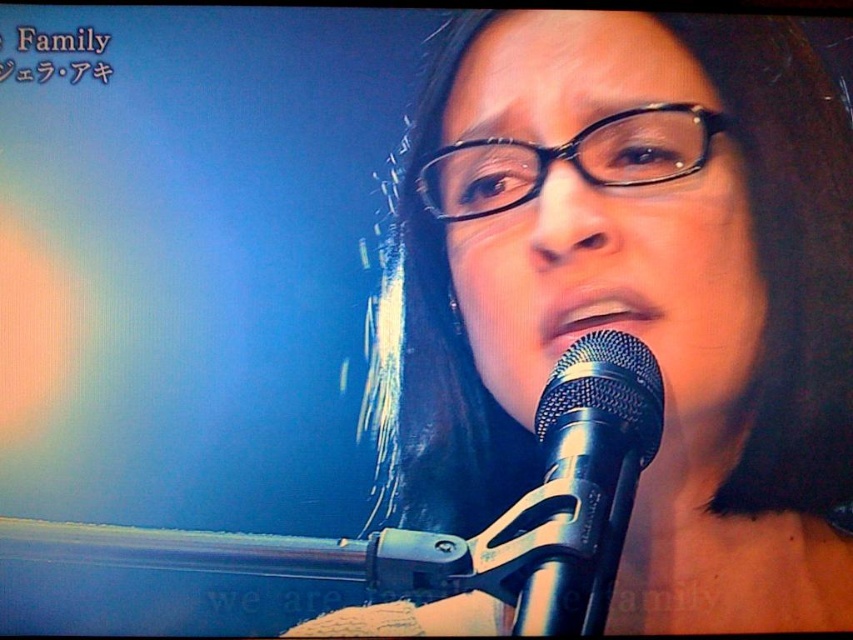
Question: Which of these objects is positioned farthest from the black metallic microphone at lower center?

Choices:
 (A) matte black microphone at center
 (B) black plastic glasses at center

Answer: (B)

Question: Which of the following is the closest to the observer?

Choices:
 (A) black plastic glasses at center
 (B) matte black microphone at center
 (C) black metallic microphone at lower center

Answer: (C)

Question: Can you confirm if black metallic microphone at lower center is positioned to the right of black plastic glasses at center?

Choices:
 (A) no
 (B) yes

Answer: (A)

Question: From the image, what is the correct spatial relationship of black metallic microphone at lower center in relation to black plastic glasses at center?

Choices:
 (A) below
 (B) above

Answer: (A)

Question: Can you confirm if matte black microphone at center is thinner than black plastic glasses at center?

Choices:
 (A) no
 (B) yes

Answer: (A)

Question: Estimate the real-world distances between objects in this image. Which object is farther from the matte black microphone at center?

Choices:
 (A) black plastic glasses at center
 (B) black metallic microphone at lower center

Answer: (B)